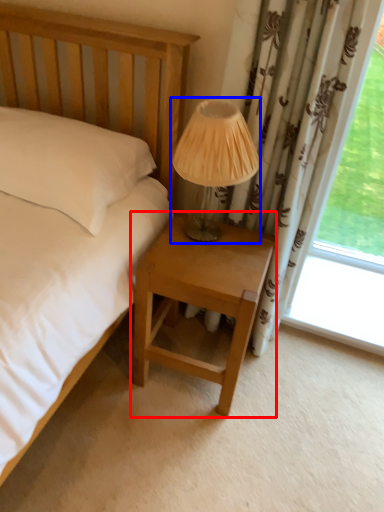
Question: Which of the following is the farthest to the observer, nightstand (highlighted by a red box) or table lamp (highlighted by a blue box)?

Choices:
 (A) nightstand
 (B) table lamp

Answer: (A)